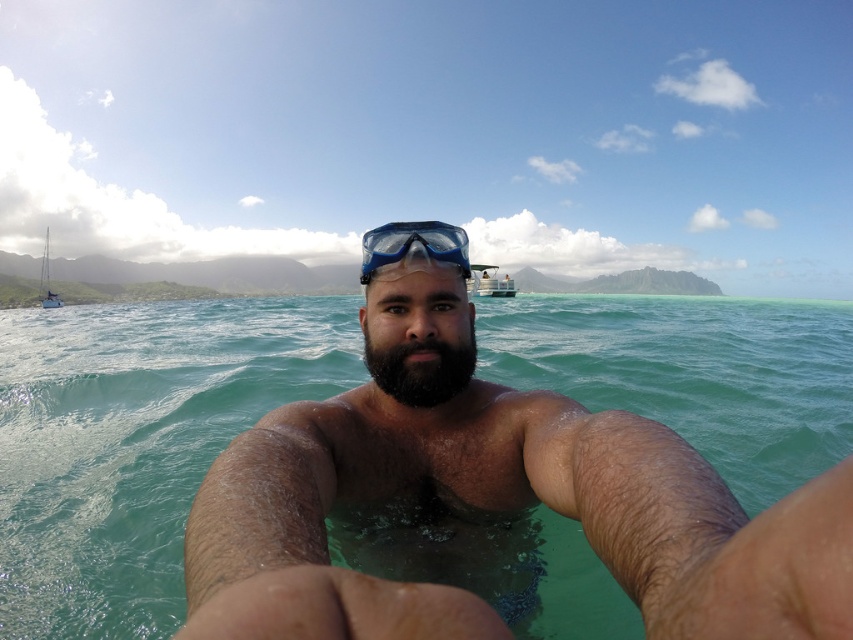
You are a photographer trying to capture the blue matte snorkel mask at center and the white plastic sailboat at left in the same frame. Based on their sizes in the image, which object would appear smaller?

The blue matte snorkel mask at center appears smaller because it has a lesser height compared to the white plastic sailboat at left.

You are a photographer trying to capture the blue matte snorkel mask at center and the white plastic sailboat at left in the same frame. Based on their positions, which object will appear larger in your photo?

The blue matte snorkel mask at center will appear larger in the photo because it is closer to the viewer than the white plastic sailboat at left.